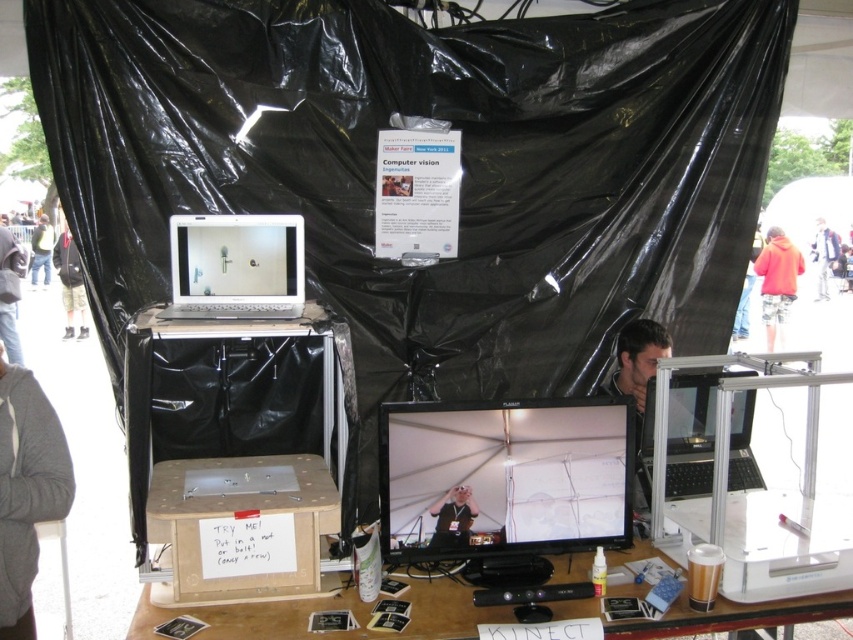
You are at the Maker Faire and need to locate two specific points on the table. The first point is at coordinates point (x=759, y=256) and the second is at point (x=64, y=292). From your vantage point, which point is closer to you?

Point (x=64, y=292) is closer to you because it is in front of point (x=759, y=256) according to the spatial relationship provided.

You are at the Maker Faire and see the gray fabric jacket at left and the red hoodie at upper right. Which item is positioned lower in the image?

The gray fabric jacket at left is located below the red hoodie at upper right, so it is positioned lower in the image.